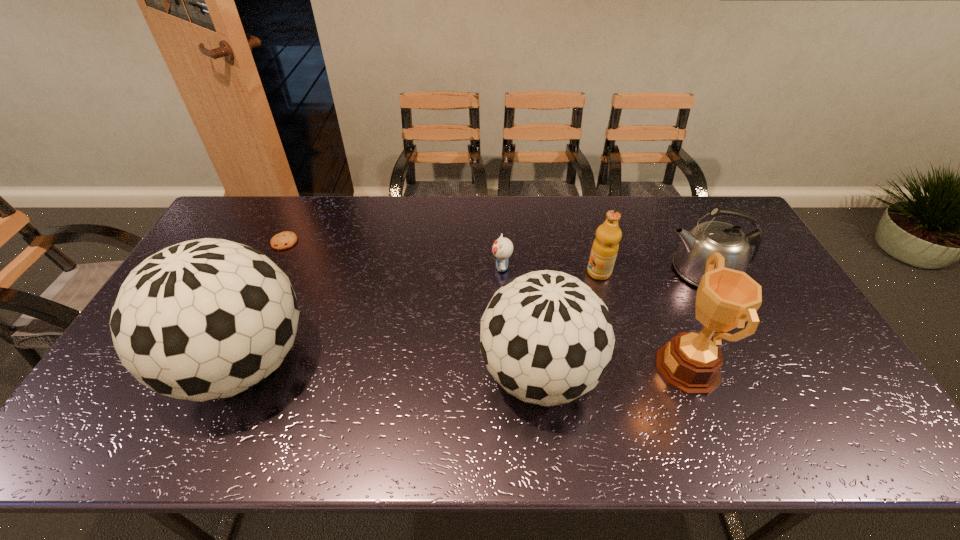
Find the location of a particular element. The image size is (960, 540). vacant area that lies between the shortest object and the kitten is located at coordinates (393, 254).

Locate an element on the screen. empty space between the award and the third object from right to left is located at coordinates (643, 320).

At what (x,y) coordinates should I click in order to perform the action: click on free spot between the fruit juice and the sixth tallest object. Please return your answer as a coordinate pair (x, y). The width and height of the screenshot is (960, 540). Looking at the image, I should click on (550, 270).

I want to click on empty space that is in between the kettle and the award, so click(x=695, y=319).

Identify the location of vacant area that lies between the kitten and the shortest object. (393, 254).

At what (x,y) coordinates should I click in order to perform the action: click on unoccupied position between the award and the fifth object from left to right. Please return your answer as a coordinate pair (x, y). Looking at the image, I should click on (643, 320).

Identify the location of free spot between the fifth object from left to right and the shortest object. This screenshot has width=960, height=540. (442, 257).

At what (x,y) coordinates should I click in order to perform the action: click on vacant area that lies between the shorter soccer ball and the kettle. Please return your answer as a coordinate pair (x, y). Looking at the image, I should click on (621, 322).

Where is `blank region between the third object from right to left and the shortest object`? This screenshot has height=540, width=960. blank region between the third object from right to left and the shortest object is located at coordinates (442, 257).

You are a GUI agent. You are given a task and a screenshot of the screen. Output one action in this format:
    pyautogui.click(x=<x>, y=<y>)
    Task: Click on the free space between the left soccer ball and the fruit juice
    This screenshot has height=540, width=960.
    Given the screenshot: What is the action you would take?
    pyautogui.click(x=420, y=319)